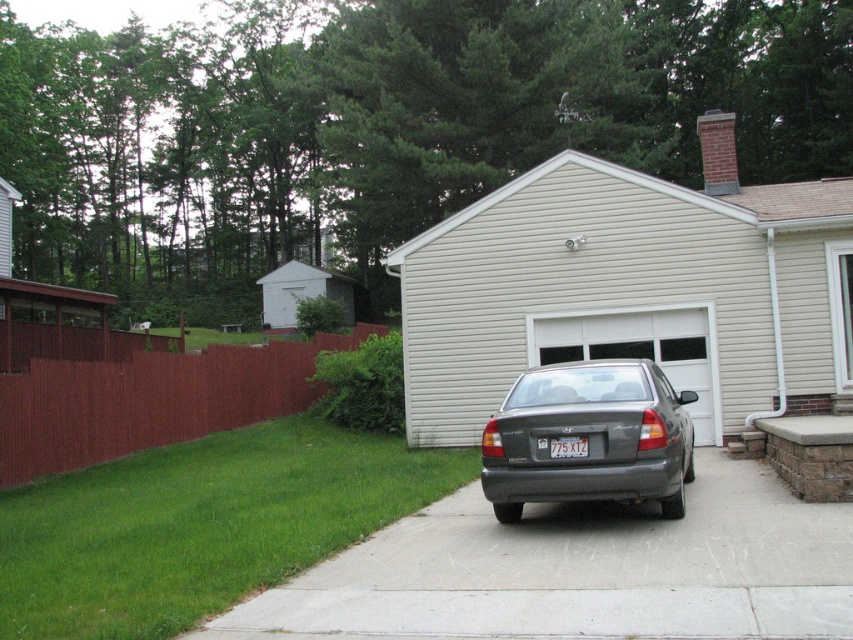
You are a painter hired to paint both the brown wood fence at left and the white wood shed at left. Which object will require more paint due to its greater height?

The white wood shed at left will require more paint because it is taller than the brown wood fence at left.

You are a delivery person trying to park a new sedan in the driveway. The sedan you have is exactly the same size as the satin gray sedan at center. There is a white plastic license plate at center that needs to remain visible. Can you park your sedan without covering the license plate?

The satin gray sedan at center and white plastic license plate at center are 34.29 inches apart. Since the sedan is parked such that the license plate is 34.29 inches away from it, parking another sedan of the same size would likely keep the license plate visible as long as alignment is maintained.

You are standing in front of the house and want to walk from the driveway to the brown wood fence at left. Which direction should you move relative to the white siding garage at center?

You should move to the left of the white siding garage at center to reach the brown wood fence at left since the white siding garage at center is positioned to the right of the brown wood fence at left.